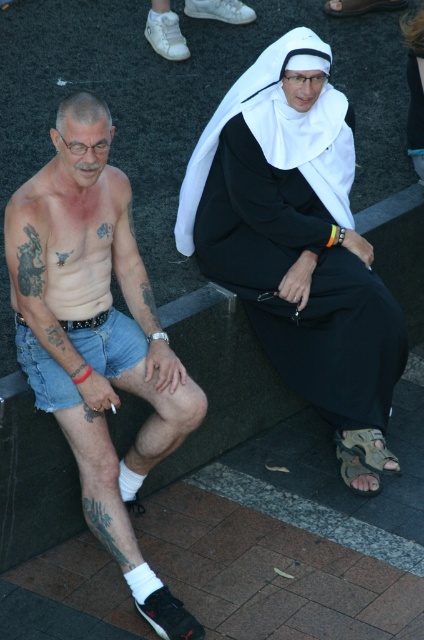
You are a photographer trying to capture a closeup of the brown leather sandal at lower center without including the black matte tattoo at lower left in the frame. Based on their positions, can you adjust your camera angle to achieve this?

The brown leather sandal at lower center is positioned on the right side of the black matte tattoo at lower left. By angling the camera to the right, you can focus on the brown leather sandal at lower center while excluding the black matte tattoo at lower left from the frame.